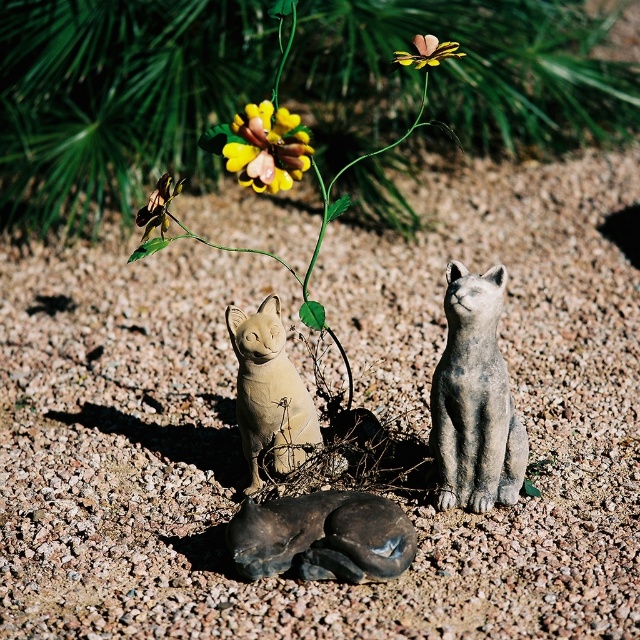
What do you see at coordinates (268, 392) in the screenshot?
I see `matte stone cat at center` at bounding box center [268, 392].

Is point (301, 387) less distant than point (296, 122)?

That is False.

Which is in front, point (288, 400) or point (237, 177)?

Point (237, 177)

Identify the location of matte stone cat at center. (x=268, y=392).

Can you confirm if gray stone cat at center is positioned above yellow matte flower at center?

Incorrect, gray stone cat at center is not positioned above yellow matte flower at center.

Who is more distant from viewer, (464, 342) or (291, 170)?

Positioned behind is point (464, 342).

This screenshot has height=640, width=640. Find the location of `gray stone cat at center`. gray stone cat at center is located at coordinates [x=474, y=400].

Image resolution: width=640 pixels, height=640 pixels. Identify the location of gray stone cat at center. (474, 400).

Does matte yellow flower at center appear under yellow matte flower at center?

Incorrect, matte yellow flower at center is not positioned below yellow matte flower at center.

Where is `matte yellow flower at center`? matte yellow flower at center is located at coordinates (118, 99).